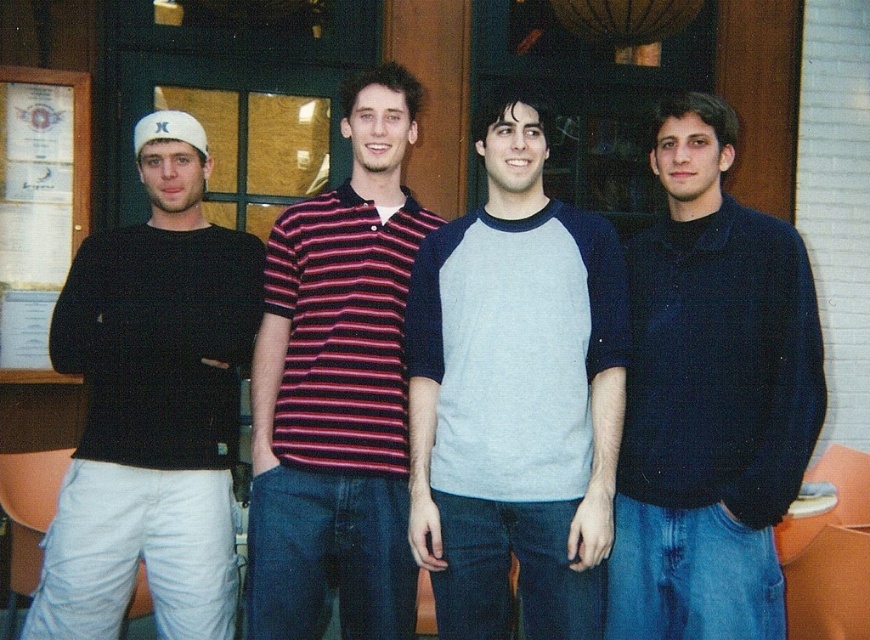
You are a photographer setting up for an outdoor group photo. You notice the black matte shirt at left and the white paperboard at left. Which object is closer to the camera based on their positions?

The black matte shirt at left is positioned under the white paperboard at left, meaning the white paperboard is closer to the camera since it is above the shirt.